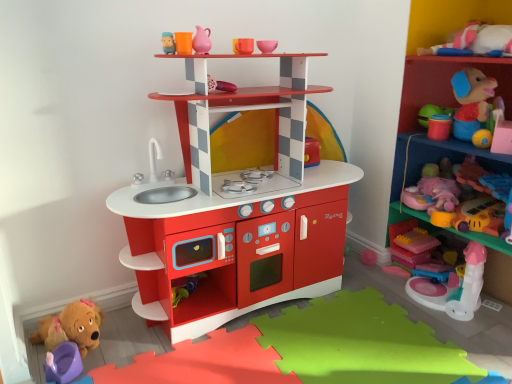
Question: Is pink plush toy at right, which ranks as the 9th toy in left-to-right order, at the back of pink plastic unicorn at upper right, acting as the third toy starting from the right?

Choices:
 (A) yes
 (B) no

Answer: (B)

Question: From the image's perspective, is pink plastic unicorn at upper right, acting as the third toy starting from the right, above pink plush toy at right, which is the 1th toy in right-to-left order?

Choices:
 (A) yes
 (B) no

Answer: (B)

Question: Is pink plastic unicorn at upper right, which ranks as the seventh toy in left-to-right order, touching pink plush toy at right, which is the 1th toy in right-to-left order?

Choices:
 (A) no
 (B) yes

Answer: (A)

Question: Does pink plastic unicorn at upper right, which ranks as the seventh toy in left-to-right order, have a greater width compared to pink plush toy at right, which ranks as the 9th toy in left-to-right order?

Choices:
 (A) yes
 (B) no

Answer: (A)

Question: Can you confirm if pink plastic unicorn at upper right, which ranks as the seventh toy in left-to-right order, is positioned to the left of pink plush toy at right, which ranks as the 9th toy in left-to-right order?

Choices:
 (A) no
 (B) yes

Answer: (B)

Question: Is smooth plastic shelf at center, which ranks as the second shelf in right-to-left order, wider or thinner than pink matte pitcher at upper center, the 3th toy positioned from the left?

Choices:
 (A) wide
 (B) thin

Answer: (A)

Question: From the image's perspective, is smooth plastic shelf at center, the 1th shelf viewed from the left, above or below pink matte pitcher at upper center, which ranks as the seventh toy in right-to-left order?

Choices:
 (A) below
 (B) above

Answer: (A)

Question: In the image, is smooth plastic shelf at center, the 1th shelf viewed from the left, on the left side or the right side of pink matte pitcher at upper center, the 3th toy positioned from the left?

Choices:
 (A) left
 (B) right

Answer: (B)

Question: Is smooth plastic shelf at center, which ranks as the second shelf in right-to-left order, bigger or smaller than pink matte pitcher at upper center, which ranks as the seventh toy in right-to-left order?

Choices:
 (A) big
 (B) small

Answer: (A)

Question: In terms of height, does matte pink cup at upper center, which ranks as the fifth toy in left-to-right order, look taller or shorter compared to brown plush dog at lower left, which is the ninth toy in right-to-left order?

Choices:
 (A) short
 (B) tall

Answer: (A)

Question: Is matte pink cup at upper center, which ranks as the fifth toy in left-to-right order, bigger or smaller than brown plush dog at lower left, which is the ninth toy in right-to-left order?

Choices:
 (A) big
 (B) small

Answer: (B)

Question: Does point (245, 41) appear closer or farther from the camera than point (88, 345)?

Choices:
 (A) farther
 (B) closer

Answer: (B)

Question: Would you say matte pink cup at upper center, which ranks as the fifth toy in left-to-right order, is inside or outside brown plush dog at lower left, acting as the 1th toy starting from the left?

Choices:
 (A) inside
 (B) outside

Answer: (B)

Question: In terms of height, does matte pink cup at upper center, marked as the fifth toy in a right-to-left arrangement, look taller or shorter compared to translucent plastic blocks at lower right, which ranks as the second toy in right-to-left order?

Choices:
 (A) short
 (B) tall

Answer: (A)

Question: From a real-world perspective, is matte pink cup at upper center, marked as the fifth toy in a right-to-left arrangement, above or below translucent plastic blocks at lower right, which ranks as the second toy in right-to-left order?

Choices:
 (A) below
 (B) above

Answer: (B)